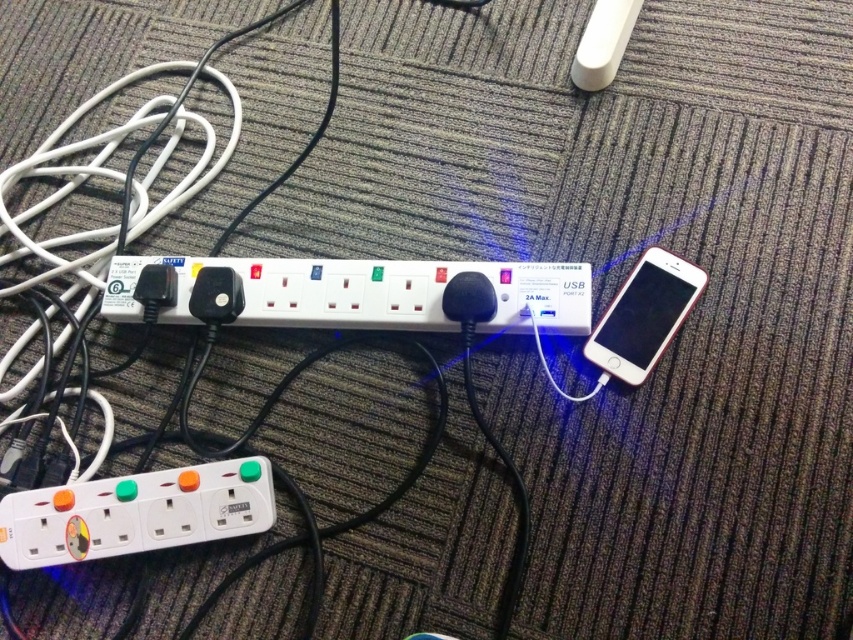
Question: Is white plastic power strip at lower left smaller than white glossy smartphone at right?

Choices:
 (A) no
 (B) yes

Answer: (A)

Question: Is white plastic power strip at center wider than white plastic power strip at lower left?

Choices:
 (A) no
 (B) yes

Answer: (B)

Question: Does white plastic power strip at center have a lesser width compared to white plastic power strip at lower left?

Choices:
 (A) yes
 (B) no

Answer: (B)

Question: Which point appears closest to the camera in this image?

Choices:
 (A) (228, 531)
 (B) (692, 285)

Answer: (A)

Question: Estimate the real-world distances between objects in this image. Which object is farther from the white plastic power strip at lower left?

Choices:
 (A) white plastic power strip at center
 (B) white glossy smartphone at right

Answer: (B)

Question: Which is nearer to the white glossy smartphone at right?

Choices:
 (A) white plastic power strip at center
 (B) white plastic power strip at lower left

Answer: (A)